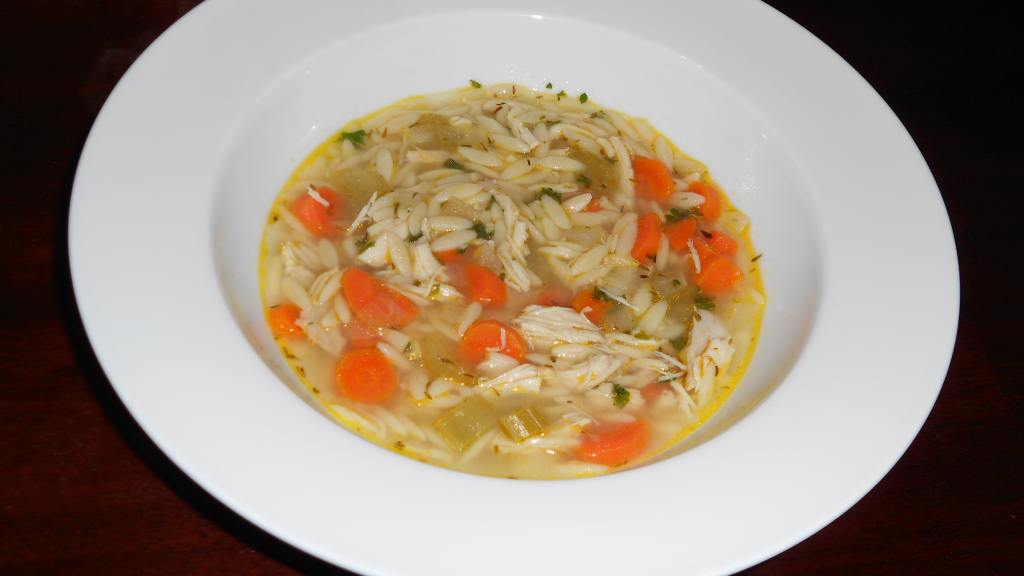
This screenshot has width=1024, height=576. I want to click on bowl, so click(x=864, y=298).